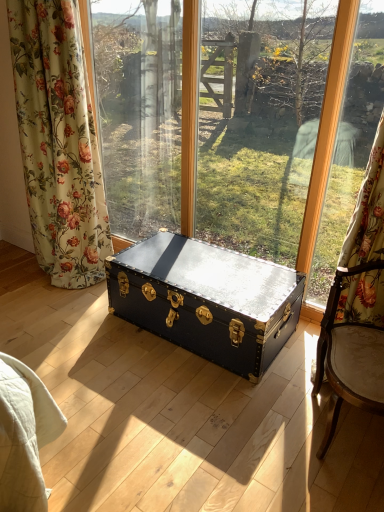
Question: Does wooden frame at right have a smaller size compared to shiny black trunk at center?

Choices:
 (A) yes
 (B) no

Answer: (A)

Question: Does wooden frame at right appear on the right side of shiny black trunk at center?

Choices:
 (A) yes
 (B) no

Answer: (A)

Question: Is shiny black trunk at center at the back of wooden frame at right?

Choices:
 (A) yes
 (B) no

Answer: (B)

Question: From a real-world perspective, is wooden frame at right beneath shiny black trunk at center?

Choices:
 (A) yes
 (B) no

Answer: (B)

Question: Is the position of wooden frame at right less distant than that of shiny black trunk at center?

Choices:
 (A) yes
 (B) no

Answer: (A)

Question: Considering the relative positions of wooden frame at right and shiny black trunk at center in the image provided, is wooden frame at right behind shiny black trunk at center?

Choices:
 (A) no
 (B) yes

Answer: (A)

Question: Could you tell me if matte black trunk at center is turned towards floral fabric curtain at left?

Choices:
 (A) yes
 (B) no

Answer: (A)

Question: Is matte black trunk at center thinner than floral fabric curtain at left?

Choices:
 (A) yes
 (B) no

Answer: (A)

Question: Is matte black trunk at center oriented away from floral fabric curtain at left?

Choices:
 (A) no
 (B) yes

Answer: (B)

Question: Does matte black trunk at center come in front of floral fabric curtain at left?

Choices:
 (A) yes
 (B) no

Answer: (A)

Question: From a real-world perspective, is matte black trunk at center located higher than floral fabric curtain at left?

Choices:
 (A) yes
 (B) no

Answer: (B)

Question: Is matte black trunk at center bigger than floral fabric curtain at left?

Choices:
 (A) no
 (B) yes

Answer: (B)

Question: Is floral fabric curtain at left outside of wooden frame at right?

Choices:
 (A) yes
 (B) no

Answer: (A)